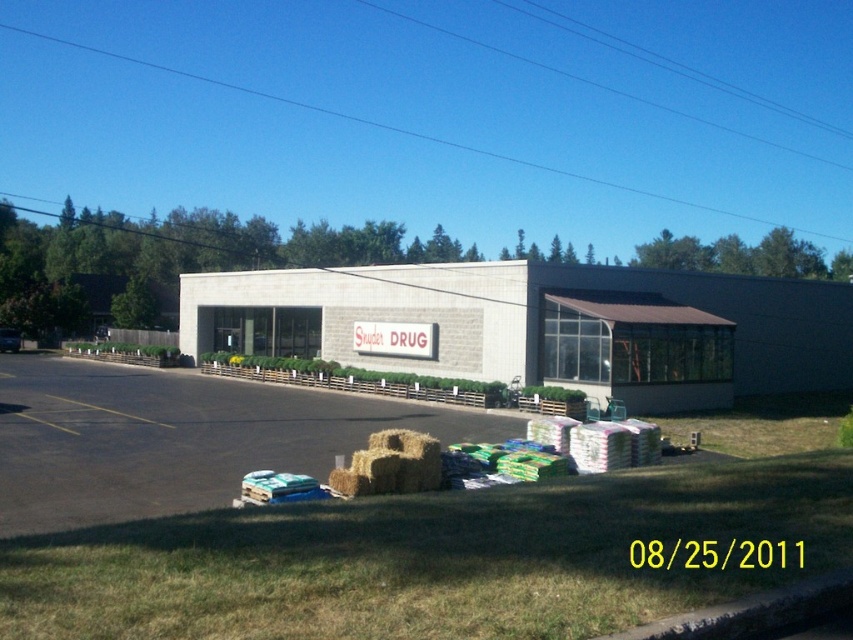
You are standing in front of the Snyder DRUG building and want to take a photo of the two points on the grassy area. Which point, point (170, 461) or point (387, 483), is closer to your camera when taking the photo?

Point (170, 461) is further to the camera than point (387, 483), so point (387, 483) is closer to the camera.

You are a delivery truck driver who needs to park your truck in the parking lot. The truck is 12 meters long. Can you park your truck in the dark asphalt parking lot at lower left without overlapping with the balehayat lower center?

The dark asphalt parking lot at lower left and balehayat lower center are 11.77 meters apart. Since the truck is 12 meters long, it would overlap with the balehayat lower center when parked there.